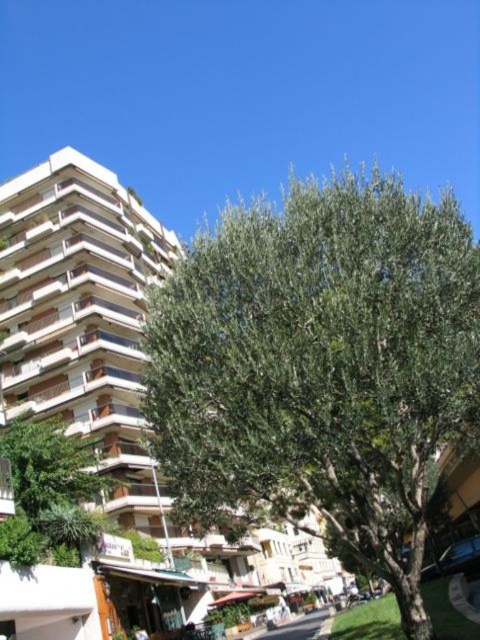
Question: Which object is farther from the camera taking this photo?

Choices:
 (A) green leafy tree at center
 (B) white textured building at center

Answer: (B)

Question: Considering the relative positions of green leafy tree at center and white textured building at center in the image provided, where is green leafy tree at center located with respect to white textured building at center?

Choices:
 (A) above
 (B) below

Answer: (A)

Question: Considering the relative positions of green leafy tree at center and white textured building at center in the image provided, where is green leafy tree at center located with respect to white textured building at center?

Choices:
 (A) left
 (B) right

Answer: (B)

Question: Does green leafy tree at center appear on the right side of white textured building at center?

Choices:
 (A) no
 (B) yes

Answer: (B)